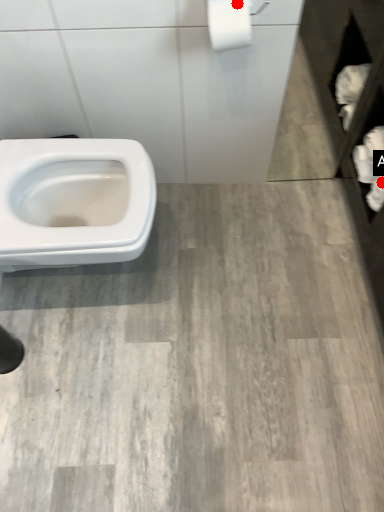
Question: Two points are circled on the image, labeled by A and B beside each circle. Which point appears farthest from the camera in this image?

Choices:
 (A) A is further
 (B) B is further

Answer: (A)